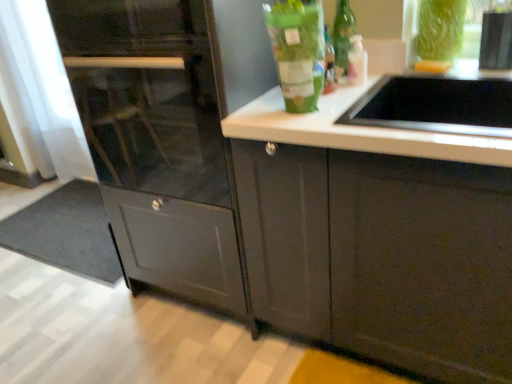
The image size is (512, 384). I want to click on free space above gray matte doormat at lower left (from a real-world perspective), so click(78, 228).